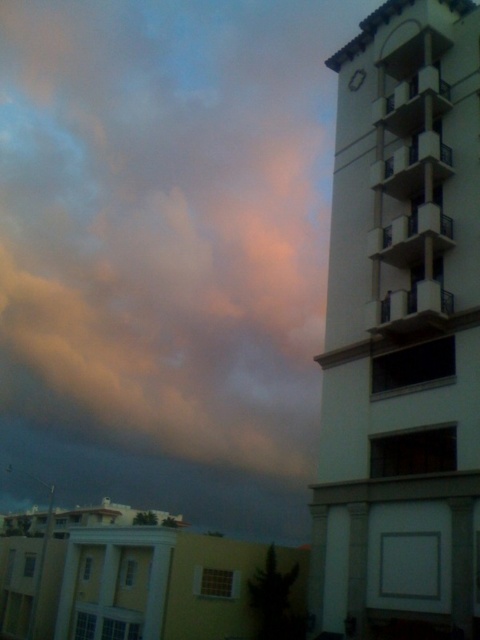
Question: Is white concrete bell tower at right closer to the viewer compared to metallic silver clock at upper right?

Choices:
 (A) yes
 (B) no

Answer: (A)

Question: Among these objects, which one is farthest from the camera?

Choices:
 (A) white concrete bell tower at right
 (B) metallic silver clock at upper right

Answer: (B)

Question: Is white concrete bell tower at right thinner than metallic silver clock at upper right?

Choices:
 (A) no
 (B) yes

Answer: (A)

Question: Is white concrete bell tower at right closer to camera compared to metallic silver clock at upper right?

Choices:
 (A) yes
 (B) no

Answer: (A)

Question: Which of the following is the farthest from the observer?

Choices:
 (A) (418, 323)
 (B) (361, 83)

Answer: (B)

Question: Which point is farther to the camera?

Choices:
 (A) white concrete bell tower at right
 (B) metallic silver clock at upper right

Answer: (B)